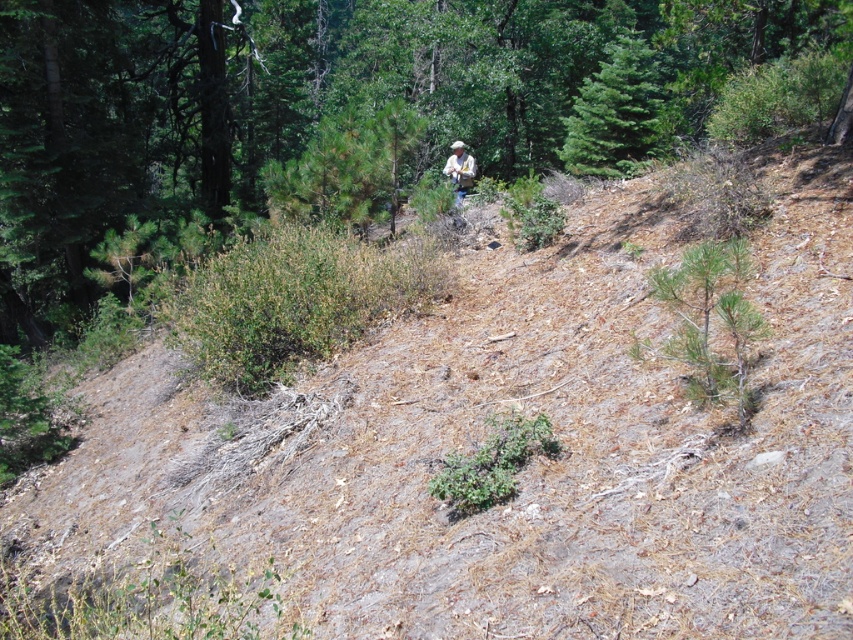
In the scene shown: You are a hiker trying to determine the best spot to set up a tent. You notice the green fir tree at upper center and the tan fabric shirt at center in the scene. Which object takes up more visual space in the image?

The tan fabric shirt at center occupies more visual space than the green fir tree at upper center according to the description.

You are a hiker trying to identify landmarks in the forest. You notice the green fir tree at upper center and the tan fabric shirt at center. Which object has a smaller width?

The green fir tree at upper center is thinner than the tan fabric shirt at center, so the green fir tree at upper center has a smaller width.

You are hiking on a forest trail and notice a green fir tree at upper center and a tan fabric shirt at center. Which object is nearer to you?

The green fir tree at upper center is closer to the viewer than the tan fabric shirt at center.